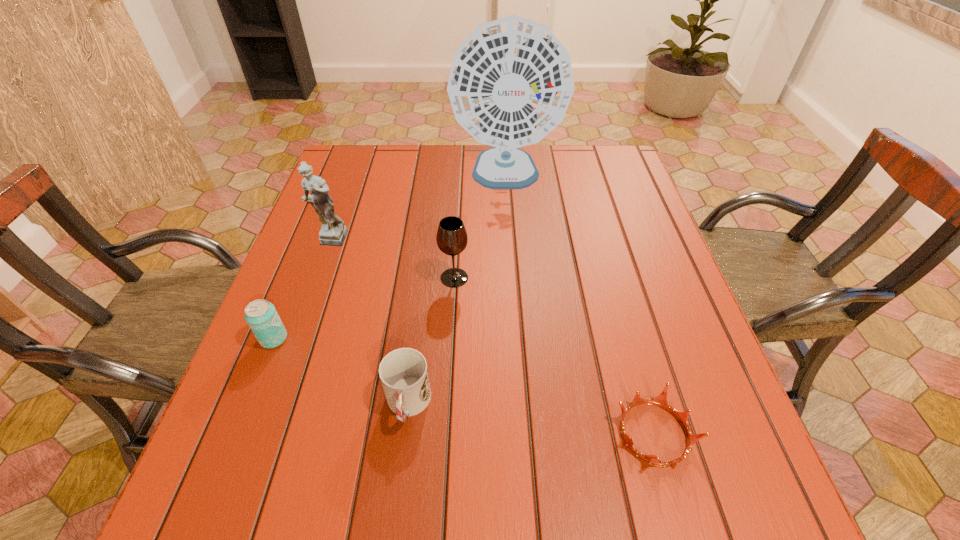
What are the coordinates of `the farthest object` in the screenshot? It's located at (511, 81).

Where is `fan`? This screenshot has height=540, width=960. fan is located at coordinates [511, 81].

In order to click on the fifth nearest object in this screenshot , I will do `click(333, 231)`.

This screenshot has height=540, width=960. I want to click on figurine, so click(x=333, y=231).

The width and height of the screenshot is (960, 540). Identify the location of the fourth shortest object. (452, 239).

At what (x,y) coordinates should I click in order to perform the action: click on wineglass. Please return your answer as a coordinate pair (x, y). This screenshot has height=540, width=960. Looking at the image, I should click on (452, 239).

What are the coordinates of `beer can` in the screenshot? It's located at (261, 316).

Where is `cup`? cup is located at coordinates (403, 372).

What are the coordinates of `crown` in the screenshot? It's located at (661, 400).

Locate an element on the screen. This screenshot has width=960, height=540. vacant point located 0.240m on the grille of the tallest object is located at coordinates (512, 268).